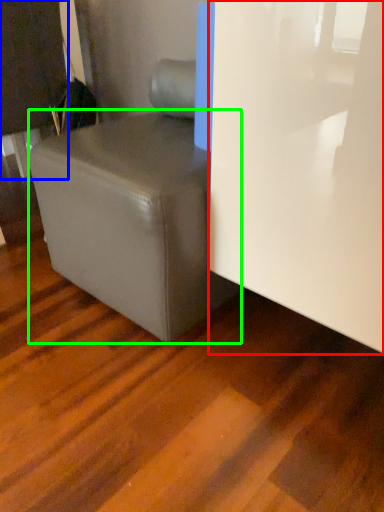
Question: Which object is positioned closest to glass door (highlighted by a red box)? Select from furniture (highlighted by a blue box) and table (highlighted by a green box).

Choices:
 (A) furniture
 (B) table

Answer: (B)